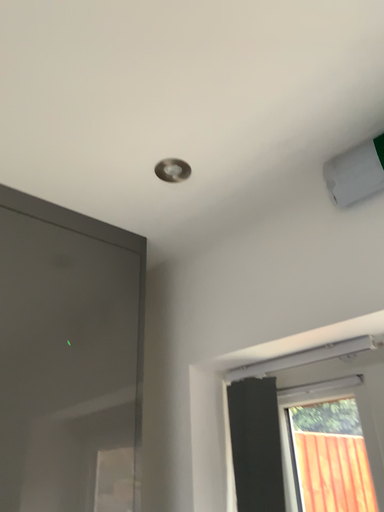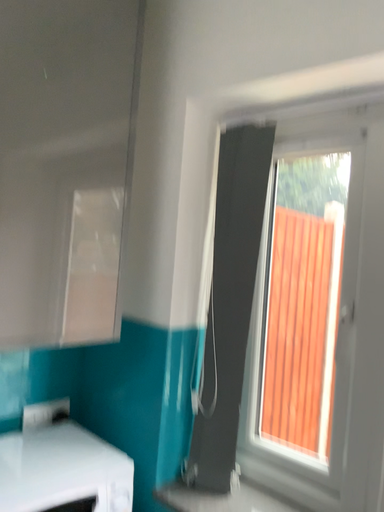
Question: Which way did the camera rotate in the video?

Choices:
 (A) rotated downward
 (B) rotated upward

Answer: (A)